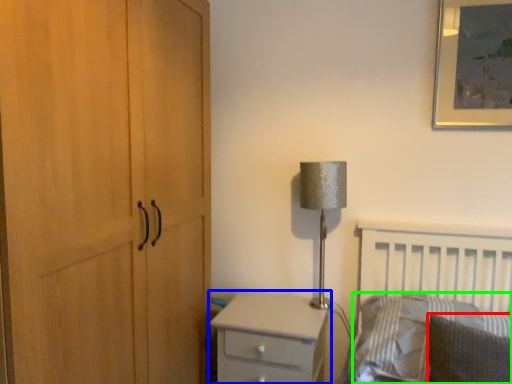
Question: Which object is positioned closest to pillow (highlighted by a red box)? Select from chest of drawers (highlighted by a blue box) and pillow (highlighted by a green box).

Choices:
 (A) chest of drawers
 (B) pillow

Answer: (B)